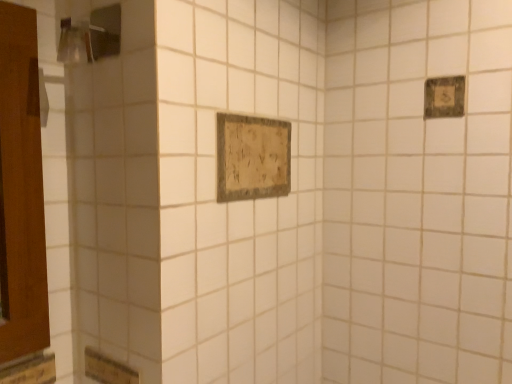
Question: From a real-world perspective, is wooden plaque at upper right, positioned as the 2th rectangle in left-to-right order, under distressed wood sign at center, which is counted as the second rectangle, starting from the right?

Choices:
 (A) no
 (B) yes

Answer: (A)

Question: Is wooden plaque at upper right, which is the 2th rectangle from bottom to top, closer to the viewer compared to distressed wood sign at center, which is counted as the second rectangle, starting from the right?

Choices:
 (A) yes
 (B) no

Answer: (B)

Question: Is wooden plaque at upper right, which is the 1th rectangle in right-to-left order, to the left of distressed wood sign at center, which is the 1th rectangle in bottom-to-top order, from the viewer's perspective?

Choices:
 (A) no
 (B) yes

Answer: (A)

Question: Are wooden plaque at upper right, acting as the first rectangle starting from the top, and distressed wood sign at center, arranged as the 1th rectangle when viewed from the left, making contact?

Choices:
 (A) yes
 (B) no

Answer: (B)

Question: Is wooden plaque at upper right, positioned as the 2th rectangle in left-to-right order, not inside distressed wood sign at center, arranged as the 1th rectangle when viewed from the left?

Choices:
 (A) yes
 (B) no

Answer: (A)

Question: Considering their positions, is wooden plaque at upper right, which is the 2th rectangle from bottom to top, located in front of or behind brushed metal shower at upper left?

Choices:
 (A) front
 (B) behind

Answer: (B)

Question: From the image's perspective, is wooden plaque at upper right, which is the 1th rectangle in right-to-left order, above or below brushed metal shower at upper left?

Choices:
 (A) below
 (B) above

Answer: (A)

Question: Based on their sizes in the image, would you say wooden plaque at upper right, which is the 1th rectangle in right-to-left order, is bigger or smaller than brushed metal shower at upper left?

Choices:
 (A) small
 (B) big

Answer: (A)

Question: From their relative heights in the image, would you say wooden plaque at upper right, which is the 1th rectangle in right-to-left order, is taller or shorter than brushed metal shower at upper left?

Choices:
 (A) tall
 (B) short

Answer: (B)

Question: Is brushed metal shower at upper left bigger or smaller than distressed wood sign at center, arranged as the 1th rectangle when viewed from the left?

Choices:
 (A) small
 (B) big

Answer: (A)

Question: From a real-world perspective, is brushed metal shower at upper left above or below distressed wood sign at center, which is counted as the second rectangle, starting from the right?

Choices:
 (A) below
 (B) above

Answer: (B)

Question: Is brushed metal shower at upper left in front of or behind distressed wood sign at center, which is counted as the second rectangle, starting from the right, in the image?

Choices:
 (A) front
 (B) behind

Answer: (A)

Question: In terms of width, does brushed metal shower at upper left look wider or thinner when compared to distressed wood sign at center, which is the 1th rectangle in bottom-to-top order?

Choices:
 (A) wide
 (B) thin

Answer: (A)

Question: Considering the positions of distressed wood sign at center, which is counted as the second rectangle, starting from the right, and wooden plaque at upper right, which is the 2th rectangle from bottom to top, in the image, is distressed wood sign at center, which is counted as the second rectangle, starting from the right, taller or shorter than wooden plaque at upper right, which is the 2th rectangle from bottom to top,?

Choices:
 (A) tall
 (B) short

Answer: (A)

Question: Is distressed wood sign at center, which is counted as the second rectangle, starting from the right, situated inside wooden plaque at upper right, which is the 2th rectangle from bottom to top, or outside?

Choices:
 (A) inside
 (B) outside

Answer: (B)